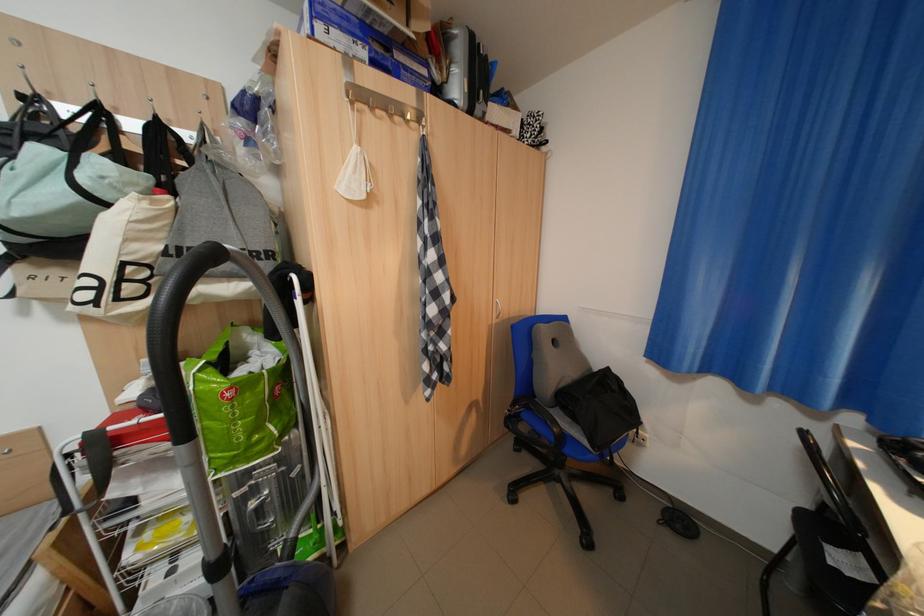
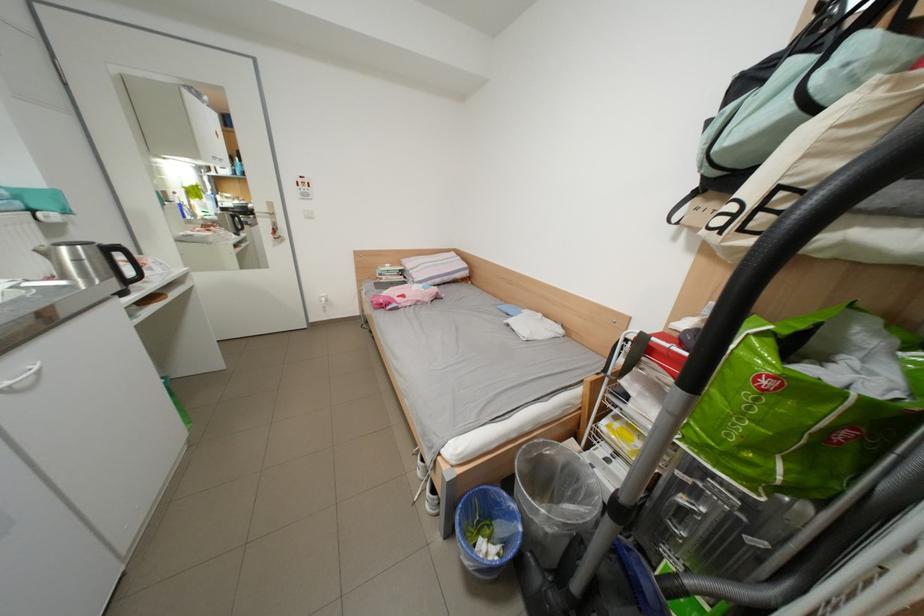
In the second image, find the point that corresponds to point (213, 296) in the first image.

(856, 245)